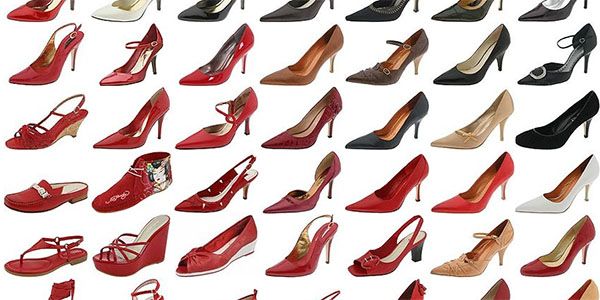
Locate an element on the screen. Image resolution: width=600 pixels, height=300 pixels. 2nd row of shoes in image is located at coordinates (42, 66), (120, 77), (201, 73), (294, 75), (372, 67), (457, 67), (546, 74).